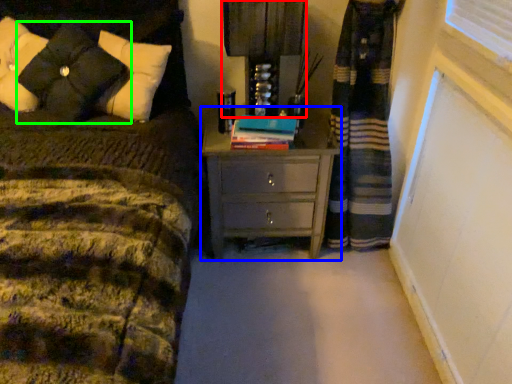
Question: Estimate the real-world distances between objects in this image. Which object is farther from bedside lamp (highlighted by a red box), chest of drawers (highlighted by a blue box) or pillow (highlighted by a green box)?

Choices:
 (A) chest of drawers
 (B) pillow

Answer: (B)